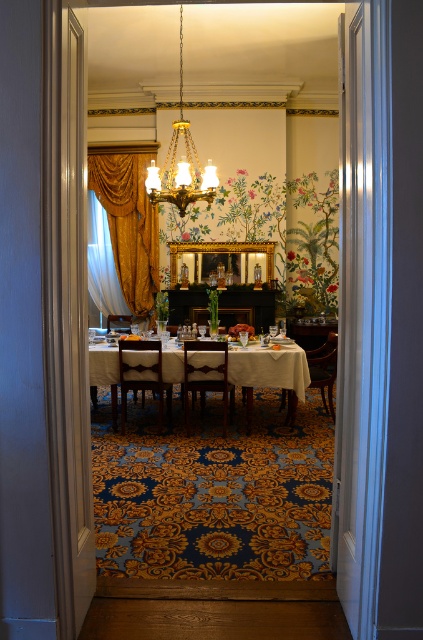
You are a guest entering the dining room through the doorway. You see the gold metallic chandelier at upper center and the wooden chair at center. Which object is closer to you as you stand at the doorway?

The gold metallic chandelier at upper center is closer to you than the wooden chair at center because the wooden chair at center is behind the gold metallic chandelier at upper center.

You are planning to place a table in the dining room. You have two chairs, the wooden chair at center and the brown leather chair at center. Which chair requires more space for placement?

The wooden chair at center might be wider than the brown leather chair at center, so it requires more space for placement.

You are a guest entering the dining room and need to choose a seat. You prefer a taller chair. Which one should you choose between the wooden chair at center and the brown leather chair at center?

The wooden chair at center is much taller than the brown leather chair at center, so you should choose the wooden chair at center.